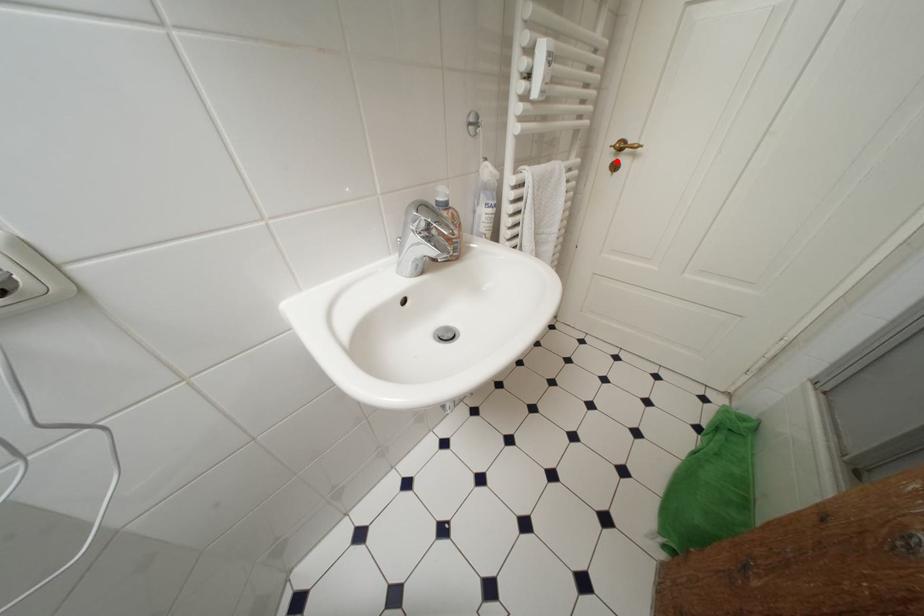
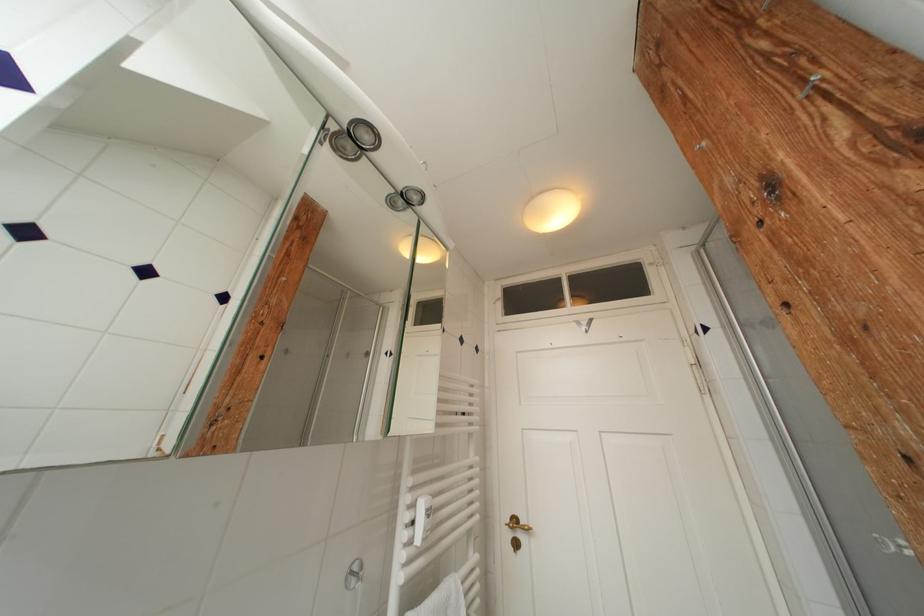
Where in the second image is the point corresponding to the highlighted location from the first image?

(516, 539)